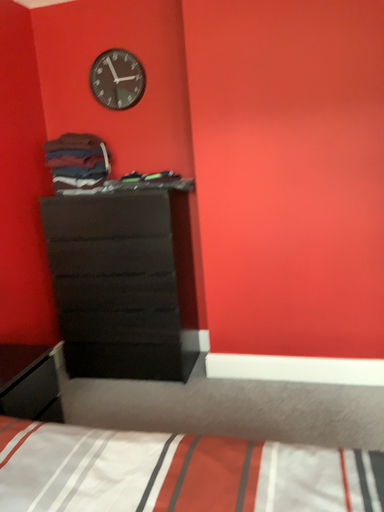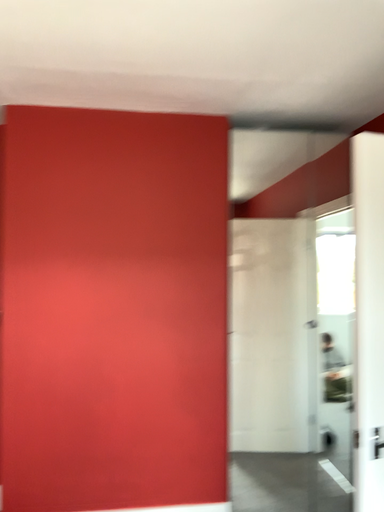
Question: How did the camera likely rotate when shooting the video?

Choices:
 (A) rotated left
 (B) rotated right

Answer: (B)